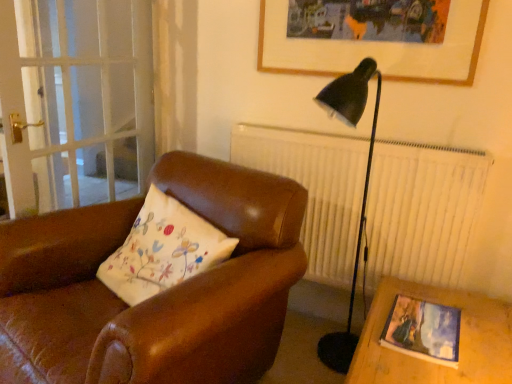
Question: Considering the relative sizes of wooden picture frame at upper center, the 1th picture frame positioned from the back, and brown leather chair at center in the image provided, is wooden picture frame at upper center, the 1th picture frame positioned from the back, smaller than brown leather chair at center?

Choices:
 (A) yes
 (B) no

Answer: (A)

Question: Is wooden picture frame at upper center, which is the 1th picture frame from top to bottom, completely or partially outside of brown leather chair at center?

Choices:
 (A) no
 (B) yes

Answer: (B)

Question: Can you confirm if wooden picture frame at upper center, acting as the 2th picture frame starting from the front, is taller than brown leather chair at center?

Choices:
 (A) no
 (B) yes

Answer: (A)

Question: Does wooden picture frame at upper center, which is the 1th picture frame from top to bottom, contain brown leather chair at center?

Choices:
 (A) no
 (B) yes

Answer: (A)

Question: Is wooden picture frame at upper center, the 1th picture frame positioned from the back, facing towards brown leather chair at center?

Choices:
 (A) yes
 (B) no

Answer: (B)

Question: From the image's perspective, is wooden picture frame at upper center, acting as the 2th picture frame starting from the front, above or below brown leather chair at center?

Choices:
 (A) above
 (B) below

Answer: (A)

Question: Considering their positions, is wooden picture frame at upper center, acting as the 2th picture frame starting from the front, located in front of or behind brown leather chair at center?

Choices:
 (A) front
 (B) behind

Answer: (B)

Question: Is wooden picture frame at upper center, the 1th picture frame positioned from the back, inside or outside of brown leather chair at center?

Choices:
 (A) inside
 (B) outside

Answer: (B)

Question: Based on their positions, is wooden picture frame at upper center, which appears as the 2th picture frame when ordered from the bottom, located to the left or right of brown leather chair at center?

Choices:
 (A) right
 (B) left

Answer: (A)

Question: Considering the relative positions of wooden picture frame at upper center, acting as the 2th picture frame starting from the front, and matte wooden picture frame at lower right, acting as the 1th picture frame starting from the front, in the image provided, is wooden picture frame at upper center, acting as the 2th picture frame starting from the front, to the left or to the right of matte wooden picture frame at lower right, acting as the 1th picture frame starting from the front,?

Choices:
 (A) right
 (B) left

Answer: (B)

Question: Considering the positions of wooden picture frame at upper center, the 1th picture frame positioned from the back, and matte wooden picture frame at lower right, the first picture frame when ordered from bottom to top, in the image, is wooden picture frame at upper center, the 1th picture frame positioned from the back, bigger or smaller than matte wooden picture frame at lower right, the first picture frame when ordered from bottom to top,?

Choices:
 (A) small
 (B) big

Answer: (B)

Question: Does point (365, 41) appear closer or farther from the camera than point (402, 327)?

Choices:
 (A) farther
 (B) closer

Answer: (A)

Question: From the image's perspective, is wooden picture frame at upper center, the 1th picture frame positioned from the back, located above or below matte wooden picture frame at lower right, acting as the 1th picture frame starting from the front?

Choices:
 (A) above
 (B) below

Answer: (A)

Question: Does point 415,329 appear closer or farther from the camera than point 9,200?

Choices:
 (A) closer
 (B) farther

Answer: (A)

Question: Based on their positions, is matte wooden picture frame at lower right, acting as the 1th picture frame starting from the front, located to the left or right of transparent glass screen door at left?

Choices:
 (A) right
 (B) left

Answer: (A)